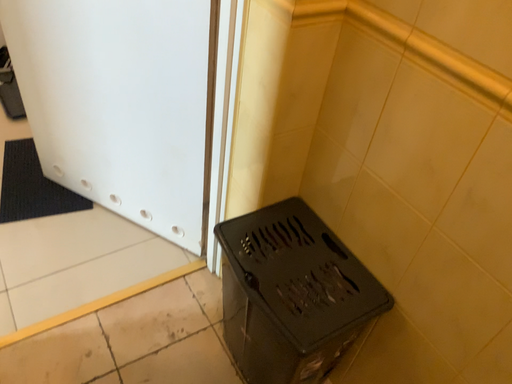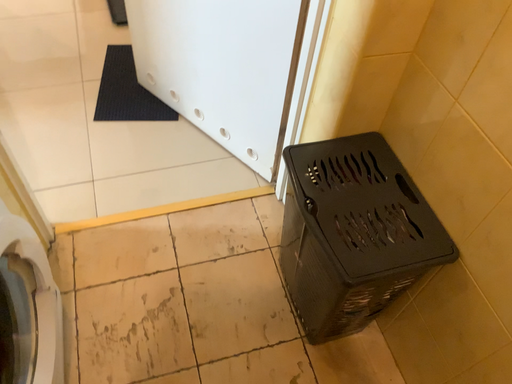
Question: Which way did the camera rotate in the video?

Choices:
 (A) rotated downward
 (B) rotated upward

Answer: (A)